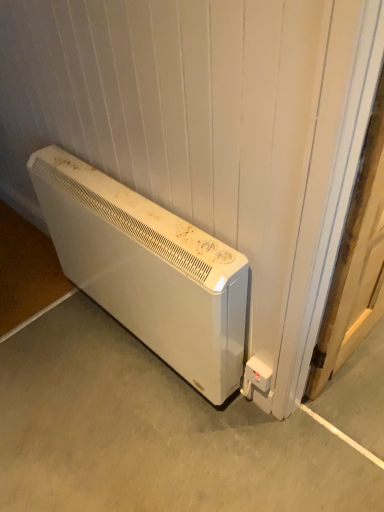
You are a GUI agent. You are given a task and a screenshot of the screen. Output one action in this format:
    pyautogui.click(x=<x>, y=<y>)
    Task: Click on the free space that is to the left of white plastic electric outlet at lower right
    The image size is (384, 512).
    Given the screenshot: What is the action you would take?
    pyautogui.click(x=206, y=417)